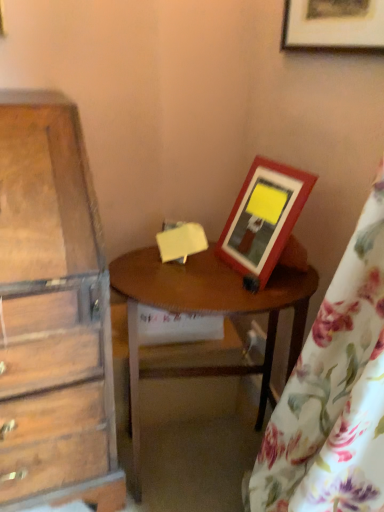
You are a GUI agent. You are given a task and a screenshot of the screen. Output one action in this format:
    pyautogui.click(x=<x>, y=<y>)
    Task: Click on the free region under wooden table at center (from a real-world perspective)
    This screenshot has width=384, height=512.
    Given the screenshot: What is the action you would take?
    pyautogui.click(x=200, y=457)